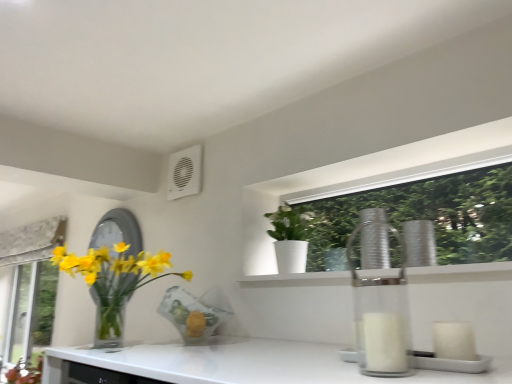
Question: Is silver metallic mirror at left at the back of white matte pot at upper center, which ranks as the 1th houseplant in right-to-left order?

Choices:
 (A) yes
 (B) no

Answer: (B)

Question: Considering the relative sizes of white matte pot at upper center, which ranks as the 1th houseplant in right-to-left order, and silver metallic mirror at left in the image provided, is white matte pot at upper center, which ranks as the 1th houseplant in right-to-left order, shorter than silver metallic mirror at left?

Choices:
 (A) no
 (B) yes

Answer: (B)

Question: Is there a large distance between white matte pot at upper center, marked as the second houseplant in a left-to-right arrangement, and silver metallic mirror at left?

Choices:
 (A) no
 (B) yes

Answer: (A)

Question: Considering the relative sizes of white matte pot at upper center, marked as the second houseplant in a left-to-right arrangement, and silver metallic mirror at left in the image provided, is white matte pot at upper center, marked as the second houseplant in a left-to-right arrangement, thinner than silver metallic mirror at left?

Choices:
 (A) no
 (B) yes

Answer: (A)

Question: Can you confirm if white matte pot at upper center, which ranks as the 1th houseplant in right-to-left order, is taller than silver metallic mirror at left?

Choices:
 (A) no
 (B) yes

Answer: (A)

Question: Considering the relative positions of silver metallic mirror at left and white matte pot at upper center, marked as the second houseplant in a left-to-right arrangement, in the image provided, is silver metallic mirror at left to the left or to the right of white matte pot at upper center, marked as the second houseplant in a left-to-right arrangement,?

Choices:
 (A) right
 (B) left

Answer: (B)

Question: From a real-world perspective, is silver metallic mirror at left physically located above or below white matte pot at upper center, which ranks as the 1th houseplant in right-to-left order?

Choices:
 (A) above
 (B) below

Answer: (B)

Question: Is silver metallic mirror at left taller or shorter than white matte pot at upper center, marked as the second houseplant in a left-to-right arrangement?

Choices:
 (A) tall
 (B) short

Answer: (A)

Question: From the image's perspective, is silver metallic mirror at left located above or below white matte pot at upper center, which ranks as the 1th houseplant in right-to-left order?

Choices:
 (A) above
 (B) below

Answer: (B)

Question: Considering the positions of translucent glass vase at left, the 1th houseplant positioned from the left, and white plastic air conditioning unit at upper center in the image, is translucent glass vase at left, the 1th houseplant positioned from the left, wider or thinner than white plastic air conditioning unit at upper center?

Choices:
 (A) thin
 (B) wide

Answer: (B)

Question: From a real-world perspective, is translucent glass vase at left, positioned as the 2th houseplant in right-to-left order, positioned above or below white plastic air conditioning unit at upper center?

Choices:
 (A) below
 (B) above

Answer: (A)

Question: Considering the positions of translucent glass vase at left, the 1th houseplant positioned from the left, and white plastic air conditioning unit at upper center in the image, is translucent glass vase at left, the 1th houseplant positioned from the left, taller or shorter than white plastic air conditioning unit at upper center?

Choices:
 (A) tall
 (B) short

Answer: (A)

Question: Is translucent glass vase at left, the 1th houseplant positioned from the left, inside the boundaries of white plastic air conditioning unit at upper center, or outside?

Choices:
 (A) inside
 (B) outside

Answer: (B)

Question: Considering the positions of point (130, 289) and point (307, 238), is point (130, 289) closer or farther from the camera than point (307, 238)?

Choices:
 (A) closer
 (B) farther

Answer: (A)

Question: Considering their positions, is translucent glass vase at left, positioned as the 2th houseplant in right-to-left order, located in front of or behind white matte pot at upper center, marked as the second houseplant in a left-to-right arrangement?

Choices:
 (A) behind
 (B) front

Answer: (B)